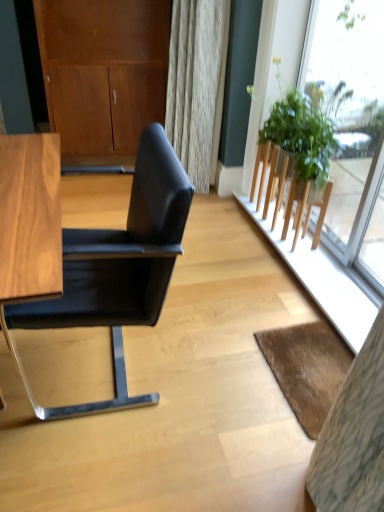
At what (x,y) coordinates should I click in order to perform the action: click on free point in front of black leather chair at left. Please return your answer as a coordinate pair (x, y). Looking at the image, I should click on (102, 458).